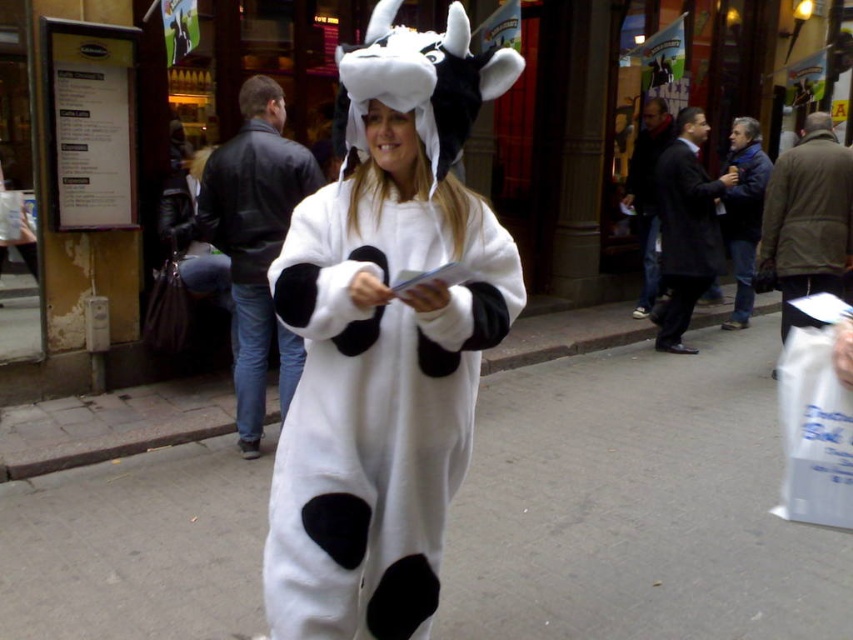
You are a delivery person carrying a package that requires a flat surface to place temporarily. You see the white smooth pavement at center and the matte black coat at center. Which surface would be more suitable for placing the package?

The white smooth pavement at center is more suitable for placing the package since it is a flat surface, while the matte black coat at center is likely not a stable surface for placing items.

You are a delivery person who needs to place a white paper bag at lower right and a matte black coat at center into a storage locker. The locker has a height limit of 1 meter. Can both items fit vertically inside the locker if stacked?

The white paper bag at lower right is positioned under matte black coat at center, which means the bag is shorter than the coat. Since the locker has a 1 meter height limit, stacking them vertically would require their combined heights to be under 1 meter. However, without knowing their individual heights, we cannot confirm if they fit. Please measure both items first.

You are a photographer standing at the center of the street. You see the white paper bag at lower right and a camera. You want to take a photo of the person in the cow costume. Which object should you use and why?

You should use the camera because it is the appropriate tool for taking photos, while the white paper bag at lower right is an object unrelated to photography. The camera is 3.90 meters away from the white paper bag at lower right, but distance isn not relevant here since the camera is needed for taking the photo.